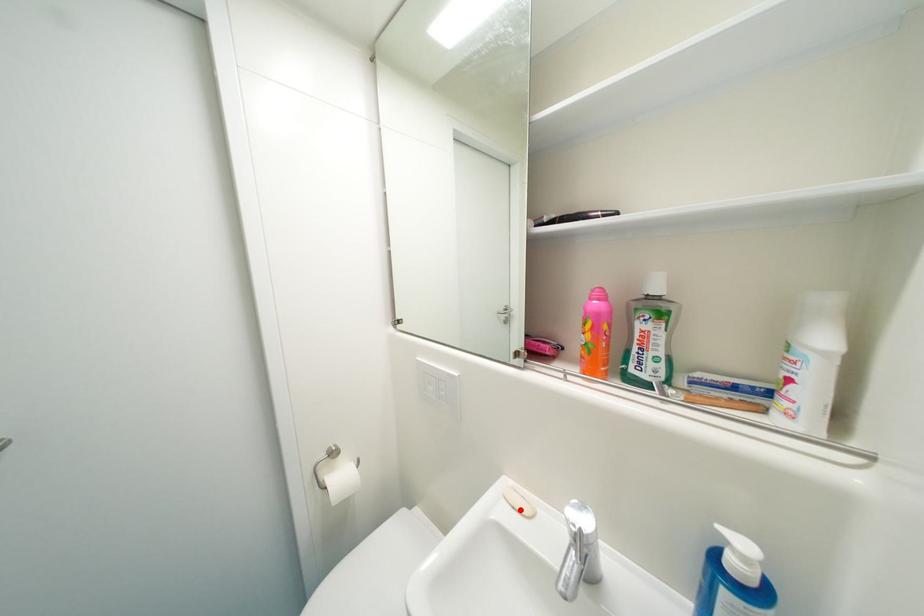
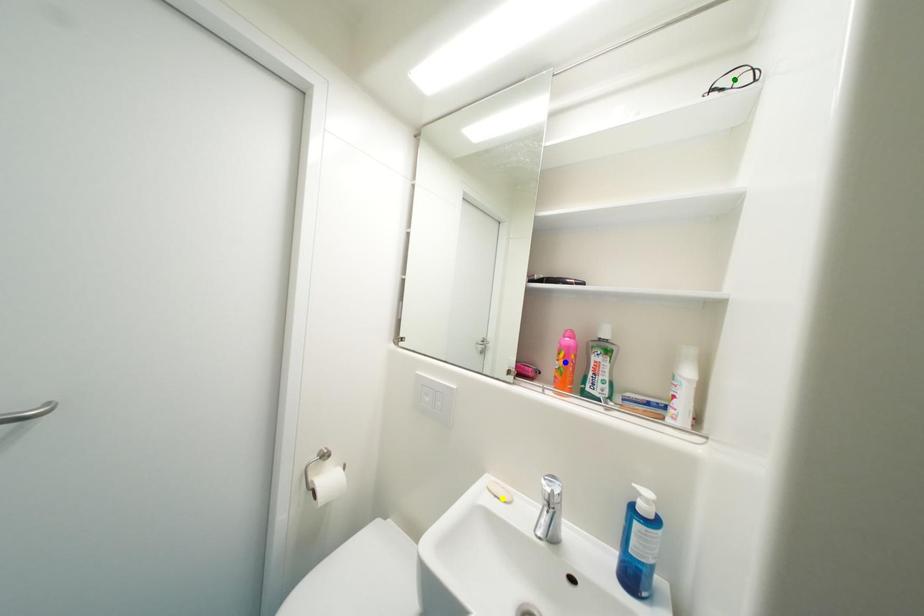
Question: I am providing you with two images of the same scene from different viewpoints. A red point is marked on the first image. You are given multiple points on the second image. Which spot in image 2 lines up with the point in image 1?

Choices:
 (A) blue point
 (B) yellow point
 (C) green point

Answer: (B)